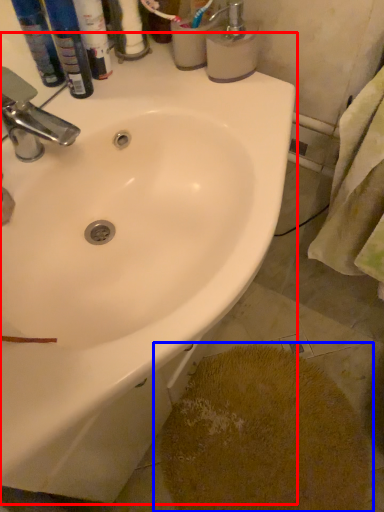
Question: Which of the following is the closest to the observer, sink (highlighted by a red box) or powder (highlighted by a blue box)?

Choices:
 (A) sink
 (B) powder

Answer: (A)